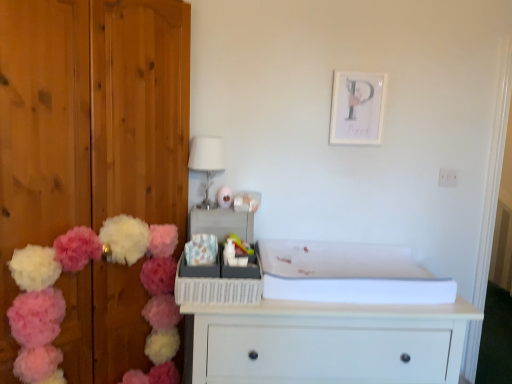
Question: Is fluffy fabric flower at center smaller than fluffy yarn pom-poms at left?

Choices:
 (A) no
 (B) yes

Answer: (B)

Question: Is fluffy fabric flower at center turned away from fluffy yarn pom-poms at left?

Choices:
 (A) no
 (B) yes

Answer: (A)

Question: Does fluffy fabric flower at center touch fluffy yarn pom-poms at left?

Choices:
 (A) no
 (B) yes

Answer: (A)

Question: Can you confirm if fluffy fabric flower at center is bigger than fluffy yarn pom-poms at left?

Choices:
 (A) yes
 (B) no

Answer: (B)

Question: From the image's perspective, is fluffy fabric flower at center located above fluffy yarn pom-poms at left?

Choices:
 (A) no
 (B) yes

Answer: (B)

Question: Considering their positions, is matte plastic toy at center located in front of or behind fluffy yarn pom-poms at left?

Choices:
 (A) behind
 (B) front

Answer: (A)

Question: In terms of size, does matte plastic toy at center appear bigger or smaller than fluffy yarn pom-poms at left?

Choices:
 (A) big
 (B) small

Answer: (B)

Question: From a real-world perspective, relative to fluffy yarn pom-poms at left, is matte plastic toy at center vertically above or below?

Choices:
 (A) above
 (B) below

Answer: (A)

Question: In terms of height, does matte plastic toy at center look taller or shorter compared to fluffy yarn pom-poms at left?

Choices:
 (A) tall
 (B) short

Answer: (B)

Question: Is white glossy lampshade at upper center spatially inside matte plastic toy at center, or outside of it?

Choices:
 (A) outside
 (B) inside

Answer: (A)

Question: Is white glossy lampshade at upper center wider or thinner than matte plastic toy at center?

Choices:
 (A) wide
 (B) thin

Answer: (A)

Question: Considering the positions of white glossy lampshade at upper center and matte plastic toy at center in the image, is white glossy lampshade at upper center taller or shorter than matte plastic toy at center?

Choices:
 (A) tall
 (B) short

Answer: (A)

Question: Considering their positions, is white glossy lampshade at upper center located in front of or behind matte plastic toy at center?

Choices:
 (A) behind
 (B) front

Answer: (B)

Question: Considering the positions of fluffy fabric flower at center and white matte picture frame at upper center in the image, is fluffy fabric flower at center taller or shorter than white matte picture frame at upper center?

Choices:
 (A) short
 (B) tall

Answer: (A)

Question: From the image's perspective, is fluffy fabric flower at center located above or below white matte picture frame at upper center?

Choices:
 (A) above
 (B) below

Answer: (B)